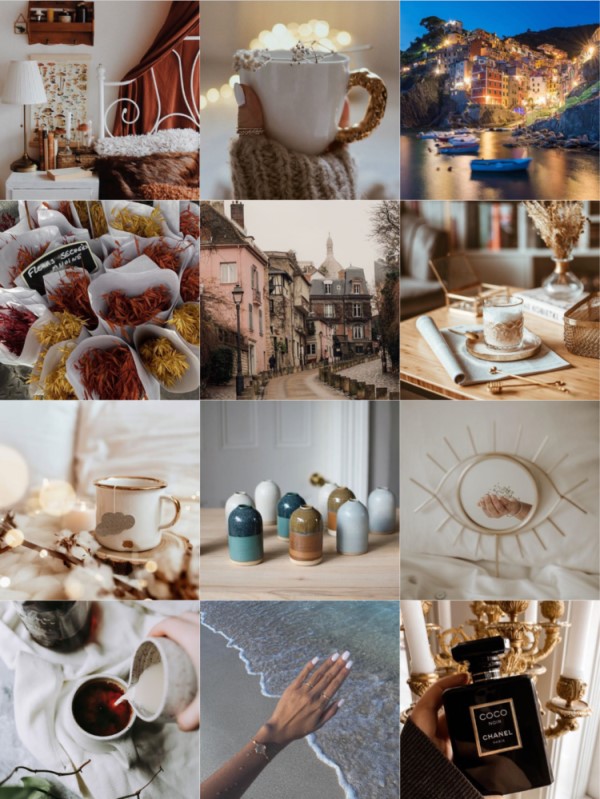
The image size is (600, 799). Identify the location of indoor pictures. (109, 686), (490, 694), (496, 503), (310, 479), (54, 487), (501, 300), (315, 122), (88, 118).